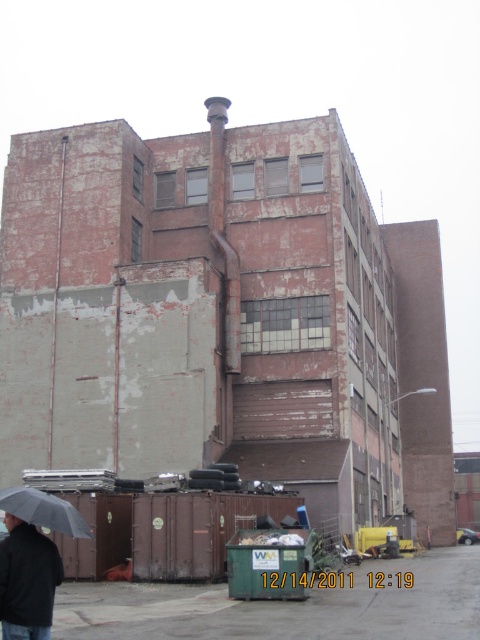
Who is more forward, (7, 625) or (39, 508)?

Point (7, 625) is in front.

Between point (23, 528) and point (1, 492), which one is positioned behind?

Positioned behind is point (1, 492).

Between point (31, 566) and point (90, 536), which one is positioned behind?

The point (90, 536) is behind.

Where is `black matte jacket at lower left`? Image resolution: width=480 pixels, height=640 pixels. black matte jacket at lower left is located at coordinates pos(26,580).